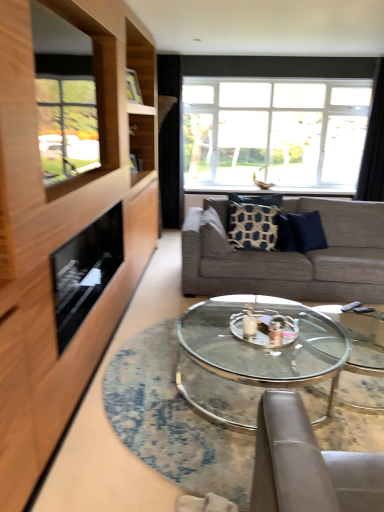
Question: Does black fabric curtain at upper center, the 2th curtain when ordered from right to left, have a smaller size compared to clear glass window at upper center?

Choices:
 (A) yes
 (B) no

Answer: (A)

Question: Is black fabric curtain at upper center, marked as the first curtain in a left-to-right arrangement, shorter than clear glass window at upper center?

Choices:
 (A) no
 (B) yes

Answer: (A)

Question: Is black fabric curtain at upper center, the 2th curtain when ordered from right to left, thinner than clear glass window at upper center?

Choices:
 (A) no
 (B) yes

Answer: (B)

Question: Is black fabric curtain at upper center, marked as the first curtain in a left-to-right arrangement, wider than clear glass window at upper center?

Choices:
 (A) yes
 (B) no

Answer: (B)

Question: From the image's perspective, is black fabric curtain at upper center, marked as the first curtain in a left-to-right arrangement, located above clear glass window at upper center?

Choices:
 (A) no
 (B) yes

Answer: (A)

Question: Is black fabric curtain at upper center, the 2th curtain when ordered from right to left, located outside clear glass window at upper center?

Choices:
 (A) yes
 (B) no

Answer: (A)

Question: Considering the relative positions of patterned fabric pillow at center, positioned as the 2th pillow in right-to-left order, and textured gray couch at center in the image provided, is patterned fabric pillow at center, positioned as the 2th pillow in right-to-left order, to the left of textured gray couch at center from the viewer's perspective?

Choices:
 (A) no
 (B) yes

Answer: (B)

Question: Can you confirm if patterned fabric pillow at center, marked as the first pillow in a left-to-right arrangement, is thinner than textured gray couch at center?

Choices:
 (A) yes
 (B) no

Answer: (A)

Question: Is patterned fabric pillow at center, positioned as the 2th pillow in right-to-left order, positioned beyond the bounds of textured gray couch at center?

Choices:
 (A) no
 (B) yes

Answer: (A)

Question: Can you confirm if patterned fabric pillow at center, positioned as the 2th pillow in right-to-left order, is bigger than textured gray couch at center?

Choices:
 (A) no
 (B) yes

Answer: (A)

Question: From a real-world perspective, does patterned fabric pillow at center, positioned as the 2th pillow in right-to-left order, stand above textured gray couch at center?

Choices:
 (A) no
 (B) yes

Answer: (B)

Question: Is the position of patterned fabric pillow at center, positioned as the 2th pillow in right-to-left order, less distant than that of textured gray couch at center?

Choices:
 (A) no
 (B) yes

Answer: (A)

Question: Is wooden frame at left thinner than patterned fabric pillow at center, positioned as the 2th pillow in right-to-left order?

Choices:
 (A) yes
 (B) no

Answer: (A)